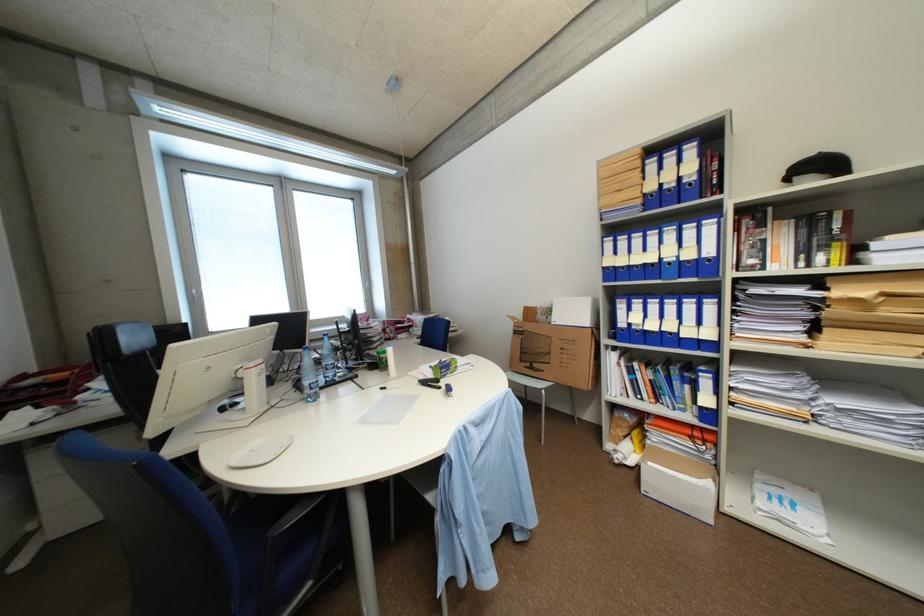
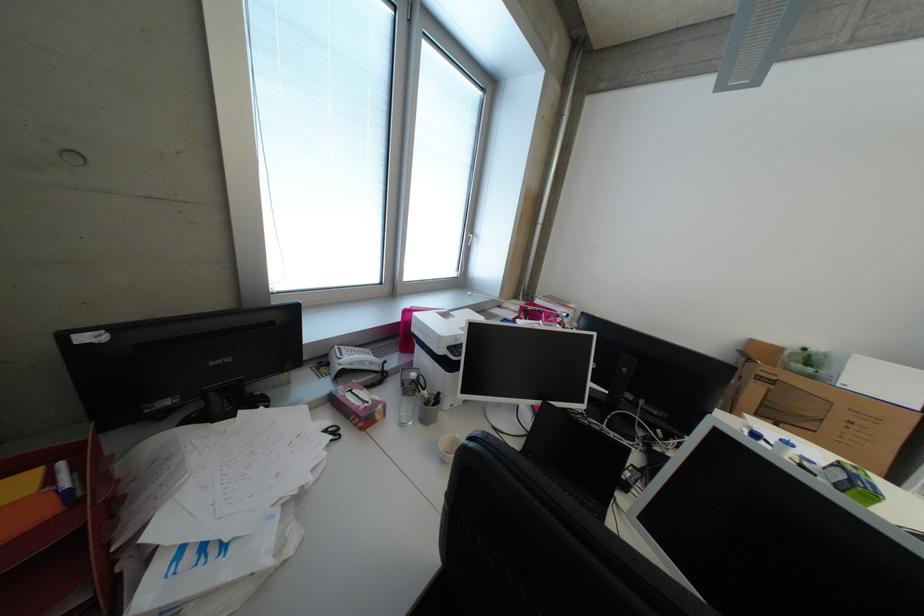
Which direction would the cameraman need to move to produce the second image?

The movement direction of the cameraman is left, forward.